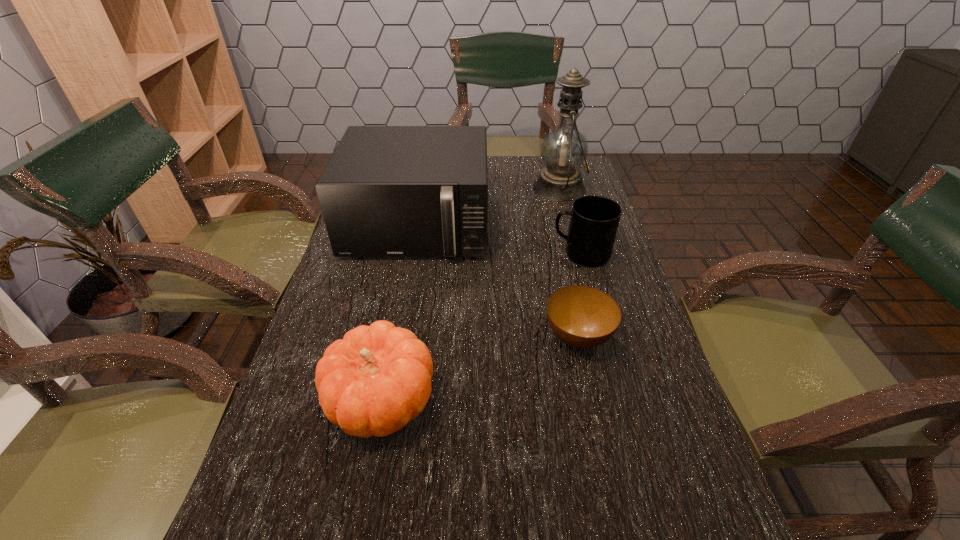
Locate an element on the screen. The height and width of the screenshot is (540, 960). free space located on the back of the pumpkin is located at coordinates (406, 269).

What are the coordinates of `vacant space located 0.290m on the back of the shortest object` in the screenshot? It's located at point(557,240).

Identify the location of object that is at the far edge. (564, 150).

The width and height of the screenshot is (960, 540). Find the location of `microwave oven positioned at the left edge`. microwave oven positioned at the left edge is located at coordinates (388, 191).

The image size is (960, 540). I want to click on pumpkin that is positioned at the left edge, so click(376, 379).

I want to click on oil lamp present at the right edge, so click(564, 150).

Where is `mug that is at the right edge`? mug that is at the right edge is located at coordinates (594, 221).

Locate an element on the screen. bowl present at the right edge is located at coordinates (584, 317).

Where is `object located at the far right corner`? This screenshot has width=960, height=540. object located at the far right corner is located at coordinates (564, 150).

This screenshot has height=540, width=960. In the image, there is a desktop. What are the coordinates of `vacant region at the far edge` in the screenshot? It's located at [529, 174].